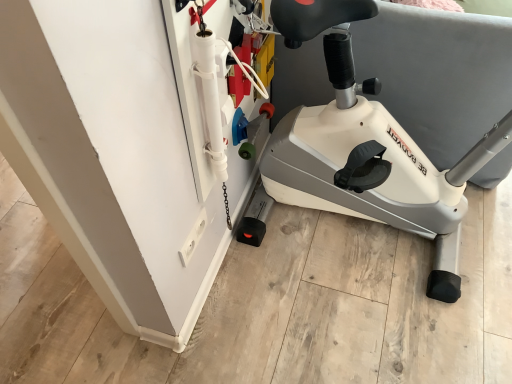
Locate an element on the screen. This screenshot has width=512, height=384. vacant space underneath white plastic stationary bicycle at center (from a real-world perspective) is located at coordinates pyautogui.click(x=376, y=239).